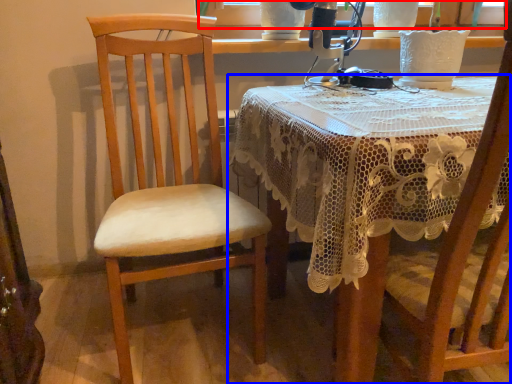
Question: Which of the following is the farthest to the observer, window screen (highlighted by a red box) or table (highlighted by a blue box)?

Choices:
 (A) window screen
 (B) table

Answer: (A)